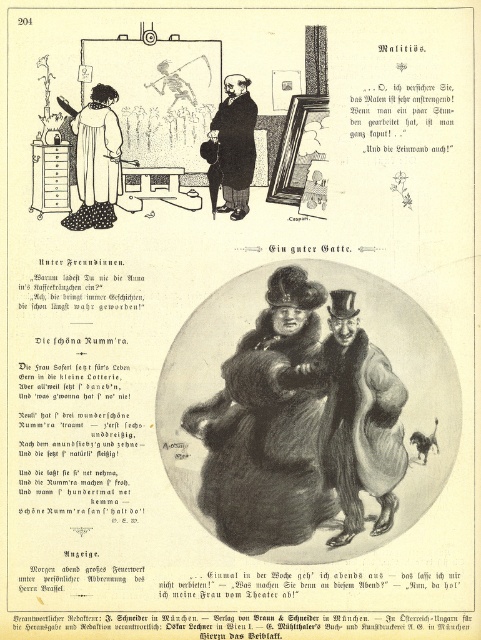
You are an art curator examining the vintage illustration. You notice two coats hanging on a rack in the studio. The coats are labeled as the smooth fur coat at center and the smooth black coat at center. Based on their positions, which coat is hanging lower on the rack?

The smooth fur coat at center is located below the smooth black coat at center, so it is hanging lower on the rack.

Looking at this image, you are an artist in the studio depicted in the image. You want to place a new sculpture exactly halfway between the two points labeled as point [334,371] and point [253,154]. Considering their positions relative to the camera, will the sculpture be closer to the camera than both points or farther away?

The sculpture placed halfway between point [334,371] and point [253,154] would be closer to the camera than point [253,154] but farther than point [334,371]. Since point [334,371] is closer to the camera, the midpoint would lie between their depths, making it not closer than both.